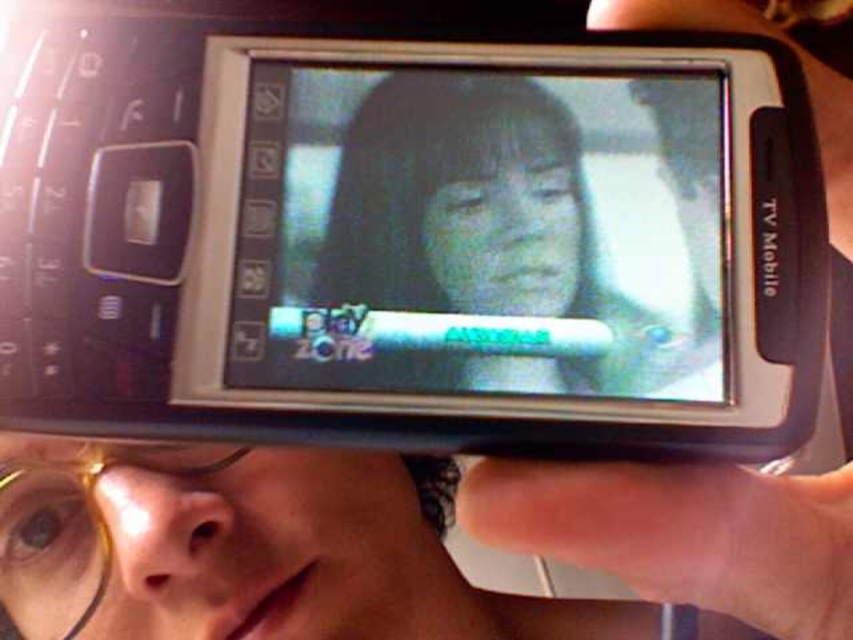
You are using a phone to take a video call. There are two points on the screen at coordinates point (395, 224) and point (836, 502). Which point is closer to the camera?

Point (836, 502) is closer to the camera than point (395, 224) because the description states that point (395, 224) is further away.